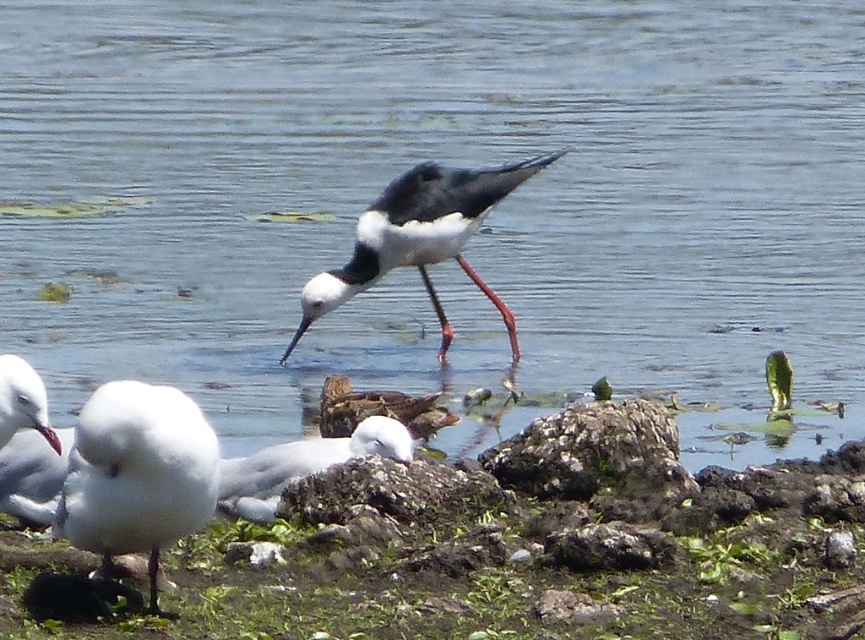
In the scene shown: Which of these two, rusty rock at lower center or white fluffy seagull at lower center, stands shorter?

With less height is rusty rock at lower center.

Consider the image. Between rusty rock at lower center and white fluffy seagull at lower center, which one is positioned lower?

rusty rock at lower center

What are the coordinates of `rusty rock at lower center` in the screenshot? It's located at (393, 492).

Is rusty rock at lower center positioned behind white matte seagull at lower left?

Yes, rusty rock at lower center is behind white matte seagull at lower left.

Between rusty rock at lower center and white matte seagull at lower left, which one has less height?

rusty rock at lower center is shorter.

Based on the photo, who is more distant from viewer, [336,477] or [17,360]?

Positioned behind is point [336,477].

Where is `rusty rock at lower center`? Image resolution: width=865 pixels, height=640 pixels. rusty rock at lower center is located at coordinates (393, 492).

Describe the element at coordinates (138, 474) in the screenshot. I see `white fluffy feather at lower left` at that location.

Who is positioned more to the right, white fluffy feather at lower left or white glossy bird at center?

white glossy bird at center is more to the right.

Is point (187, 467) closer to viewer compared to point (444, 204)?

Yes, point (187, 467) is closer to viewer.

At what (x,y) coordinates should I click in order to perform the action: click on white fluffy feather at lower left. Please return your answer as a coordinate pair (x, y). Image resolution: width=865 pixels, height=640 pixels. Looking at the image, I should click on (138, 474).